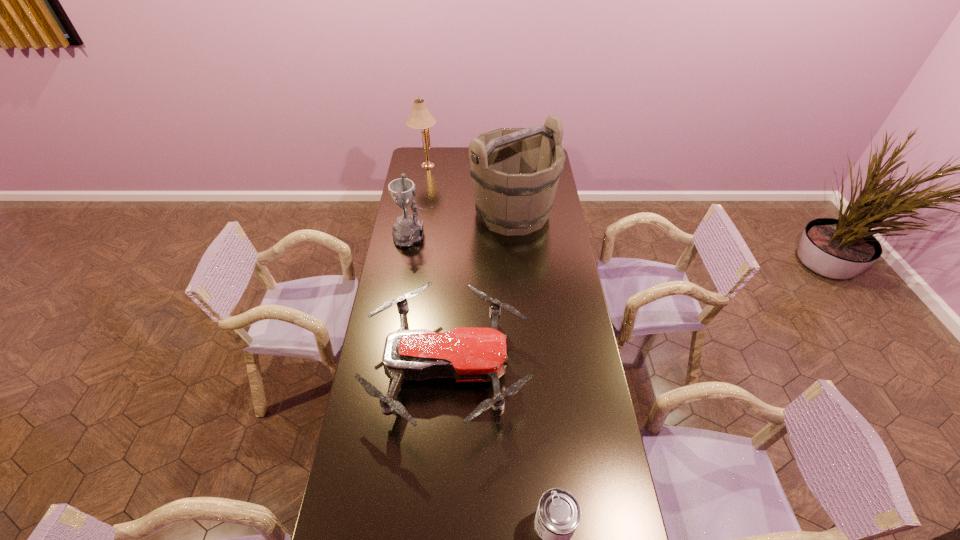
You are a GUI agent. You are given a task and a screenshot of the screen. Output one action in this format:
    pyautogui.click(x=<x>, y=<y>)
    Task: Click on the award that is at the left edge
    This screenshot has width=960, height=540.
    Given the screenshot: What is the action you would take?
    pyautogui.click(x=408, y=230)

Locate an element on the screen. Image resolution: width=960 pixels, height=540 pixels. drone present at the left edge is located at coordinates (468, 354).

Where is `object present at the right edge`? object present at the right edge is located at coordinates (515, 172).

I want to click on object that is at the far left corner, so click(420, 118).

In order to click on free space at the far edge of the desktop in this screenshot , I will do `click(461, 152)`.

At what (x,y) coordinates should I click in order to perform the action: click on free space at the left edge. Please return your answer as a coordinate pair (x, y). Looking at the image, I should click on (365, 434).

Where is `vacant point at the right edge`? vacant point at the right edge is located at coordinates (573, 375).

You are a GUI agent. You are given a task and a screenshot of the screen. Output one action in this format:
    pyautogui.click(x=<x>, y=<y>)
    Task: Click on the free spot between the third tallest object and the farthest object
    
    Given the screenshot: What is the action you would take?
    pyautogui.click(x=420, y=200)

The width and height of the screenshot is (960, 540). Identify the location of free point between the third shortest object and the fourth farthest object. (431, 302).

At what (x,y) coordinates should I click in order to perform the action: click on free space between the bucket and the third shortest object. Please return your answer as a coordinate pair (x, y). Looking at the image, I should click on tap(464, 224).